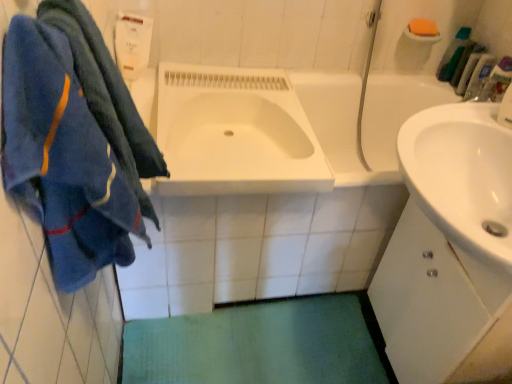
Describe the element at coordinates (287, 211) in the screenshot. I see `white glossy bathtub at center` at that location.

What is the approximate height of white glossy bathtub at center?

The height of white glossy bathtub at center is 23.94 inches.

Locate an element on the screen. This screenshot has height=384, width=512. white matte cabinet at right is located at coordinates tap(440, 308).

Measure the distance between point (325, 332) and camera.

Point (325, 332) and camera are 1.52 meters apart from each other.

What do you see at coordinates (423, 27) in the screenshot? I see `orange sponge at upper right` at bounding box center [423, 27].

What is the approximate height of green plastic bottles at upper right, positioned as the second toiletry in top-to-bottom order?

The height of green plastic bottles at upper right, positioned as the second toiletry in top-to-bottom order, is 18.99 centimeters.

At what (x,y) coordinates should I click in order to perform the action: click on white glossy sink at center. Please return your answer as a coordinate pair (x, y). The height and width of the screenshot is (384, 512). Looking at the image, I should click on (234, 133).

Is green plastic bottles at upper right, positioned as the second toiletry in top-to-bottom order, not close to white glossy bathtub at center?

green plastic bottles at upper right, positioned as the second toiletry in top-to-bottom order, is positioned a significant distance from white glossy bathtub at center.

From a real-world perspective, which object rests below the other?

From a 3D spatial view, white glossy bathtub at center is below.

Which object is positioned more to the right, green plastic bottles at upper right, placed as the second toiletry when sorted from bottom to top, or white glossy bathtub at center?

Positioned to the right is green plastic bottles at upper right, placed as the second toiletry when sorted from bottom to top.

Is white glossy bathtub at center a part of green plastic bottles at upper right, placed as the second toiletry when sorted from bottom to top?

No, white glossy bathtub at center is not surrounded by green plastic bottles at upper right, placed as the second toiletry when sorted from bottom to top.

From the image's perspective, is white matte cabinet at right located above green plastic toothbrush at upper right, marked as the first toiletry in a top-to-bottom arrangement?

No.

Is white matte cabinet at right positioned behind green plastic toothbrush at upper right, positioned as the third toiletry in bottom-to-top order?

No.

Locate an element on the screen. the 3rd toiletry behind the white matte cabinet at right, starting your count from the anchor is located at coordinates (453, 55).

Which of these two, white matte cabinet at right or green plastic toothbrush at upper right, marked as the first toiletry in a top-to-bottom arrangement, stands taller?

Standing taller between the two is white matte cabinet at right.

Is there a large distance between clear plastic bottle at upper right, marked as the 1th toiletry in a bottom-to-top arrangement, and white glossy sink at center?

Actually, clear plastic bottle at upper right, marked as the 1th toiletry in a bottom-to-top arrangement, and white glossy sink at center are a little close together.

Is clear plastic bottle at upper right, marked as the 1th toiletry in a bottom-to-top arrangement, facing away from white glossy sink at center?

No, clear plastic bottle at upper right, marked as the 1th toiletry in a bottom-to-top arrangement, is not facing away from white glossy sink at center.

What's the angular difference between clear plastic bottle at upper right, the third toiletry positioned from the top, and white glossy sink at center's facing directions?

The angular difference between clear plastic bottle at upper right, the third toiletry positioned from the top, and white glossy sink at center is 1.7 degrees.

Identify the location of sink on the left of the clear plastic bottle at upper right, the third toiletry positioned from the top. (234, 133).

From the image's perspective, which one is positioned lower, white glossy sink at center or green plastic bottles at upper right, placed as the second toiletry when sorted from bottom to top?

From the image's view, white glossy sink at center is below.

Is white glossy sink at center surrounding green plastic bottles at upper right, positioned as the second toiletry in top-to-bottom order?

No, green plastic bottles at upper right, positioned as the second toiletry in top-to-bottom order, is not a part of white glossy sink at center.

Considering the sizes of objects white glossy sink at center and green plastic bottles at upper right, placed as the second toiletry when sorted from bottom to top, in the image provided, who is thinner, white glossy sink at center or green plastic bottles at upper right, placed as the second toiletry when sorted from bottom to top,?

Thinner between the two is green plastic bottles at upper right, placed as the second toiletry when sorted from bottom to top.

Is green fabric bath mat at lower center in contact with orange sponge at upper right?

No, green fabric bath mat at lower center is not making contact with orange sponge at upper right.

From a real-world perspective, is green fabric bath mat at lower center over orange sponge at upper right?

No, from a real-world perspective, green fabric bath mat at lower center is not over orange sponge at upper right

Consider the image. Does green fabric bath mat at lower center turn towards orange sponge at upper right?

No, green fabric bath mat at lower center is not aimed at orange sponge at upper right.

Is orange sponge at upper right to the right of green plastic toothbrush at upper right, positioned as the third toiletry in bottom-to-top order, from the viewer's perspective?

No.

Which is behind, orange sponge at upper right or green plastic toothbrush at upper right, positioned as the third toiletry in bottom-to-top order?

Positioned behind is green plastic toothbrush at upper right, positioned as the third toiletry in bottom-to-top order.

Is orange sponge at upper right oriented away from green plastic toothbrush at upper right, marked as the first toiletry in a top-to-bottom arrangement?

No, orange sponge at upper right is not facing the opposite direction of green plastic toothbrush at upper right, marked as the first toiletry in a top-to-bottom arrangement.

Find the location of `toiletry that is the 1st one below the orange sponge at upper right (from a real-world perspective)`. toiletry that is the 1st one below the orange sponge at upper right (from a real-world perspective) is located at coordinates (453, 55).

Consider the image. Is white matte cabinet at right bigger than green fabric bath mat at lower center?

Yes.

Is the surface of white matte cabinet at right in direct contact with green fabric bath mat at lower center?

No, white matte cabinet at right is not next to green fabric bath mat at lower center.

From the image's perspective, is white matte cabinet at right located above green fabric bath mat at lower center?

Indeed, from the image's perspective, white matte cabinet at right is shown above green fabric bath mat at lower center.

Does white matte cabinet at right have a greater width compared to green fabric bath mat at lower center?

Incorrect, the width of white matte cabinet at right does not surpass that of green fabric bath mat at lower center.

I want to click on bath that is under the green plastic bottles at upper right, placed as the second toiletry when sorted from bottom to top (from a real-world perspective), so click(287, 211).

Locate an element on the screen. bathroom cabinet lying on the left of green plastic toothbrush at upper right, positioned as the third toiletry in bottom-to-top order is located at coordinates (440, 308).

Based on their spatial positions, is blue fuzzy towel at left or green fabric bath mat at lower center further from white glossy sink at center?

green fabric bath mat at lower center lies further to white glossy sink at center than the other object.

Looking at the image, which one is located closer to orange sponge at upper right, white matte cabinet at right or blue fuzzy towel at left?

white matte cabinet at right lies closer to orange sponge at upper right than the other object.

Based on their spatial positions, is green fabric bath mat at lower center or green plastic toothbrush at upper right, marked as the first toiletry in a top-to-bottom arrangement, closer to blue fuzzy towel at left?

green fabric bath mat at lower center is closer to blue fuzzy towel at left.

Which object lies further to the anchor point white matte cabinet at right, white glossy bathtub at center or orange sponge at upper right?

Based on the image, orange sponge at upper right appears to be further to white matte cabinet at right.

From the image, which object appears to be nearer to blue fuzzy towel at left, white matte cabinet at right or green fabric bath mat at lower center?

white matte cabinet at right is closer to blue fuzzy towel at left.

Considering their positions, is green plastic bottles at upper right, placed as the second toiletry when sorted from bottom to top, positioned closer to white glossy sink at center than blue fuzzy towel at left?

The object closer to white glossy sink at center is blue fuzzy towel at left.

When comparing their distances from white glossy bathtub at center, does white matte cabinet at right or green plastic bottles at upper right, positioned as the second toiletry in top-to-bottom order, seem further?

green plastic bottles at upper right, positioned as the second toiletry in top-to-bottom order, is further to white glossy bathtub at center.

Considering their positions, is white glossy sink at center positioned further to green plastic toothbrush at upper right, marked as the first toiletry in a top-to-bottom arrangement, than white glossy bathtub at center?

Based on the image, white glossy bathtub at center appears to be further to green plastic toothbrush at upper right, marked as the first toiletry in a top-to-bottom arrangement.

Find the location of a particular element. The image size is (512, 384). bath mat located between white glossy sink at center and clear plastic bottle at upper right, marked as the 1th toiletry in a bottom-to-top arrangement, in the left-right direction is located at coordinates (262, 344).

Where is `bath located between blue fuzzy towel at left and orange sponge at upper right in the depth direction`? bath located between blue fuzzy towel at left and orange sponge at upper right in the depth direction is located at coordinates (287, 211).

In order to click on bath mat situated between blue fuzzy towel at left and white matte cabinet at right from left to right in this screenshot , I will do `click(262, 344)`.

Locate an element on the screen. soap located between white glossy sink at center and green plastic toothbrush at upper right, marked as the first toiletry in a top-to-bottom arrangement, in the left-right direction is located at coordinates (423, 27).